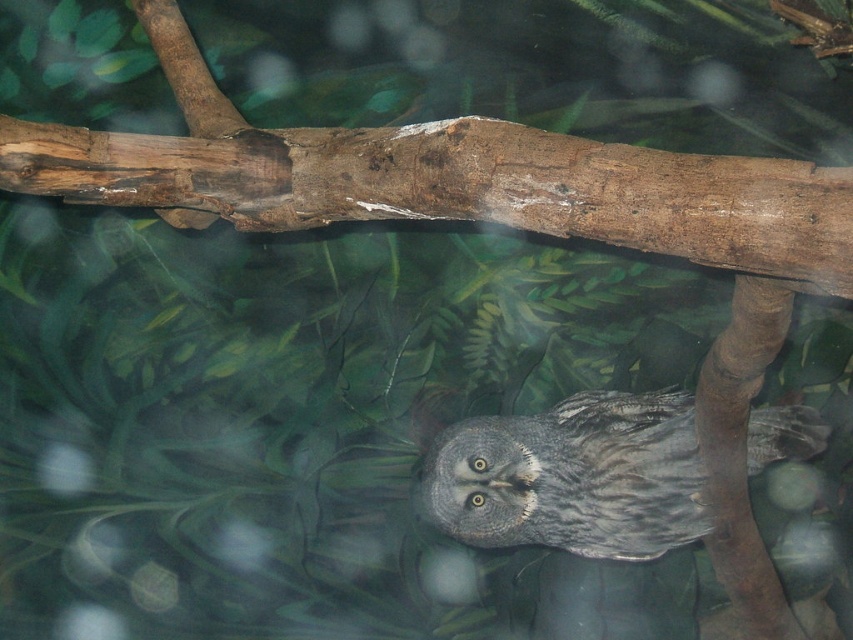
Question: Is brown rough wood at upper center smaller than gray fluffy owl at center?

Choices:
 (A) yes
 (B) no

Answer: (B)

Question: Among these points, which one is nearest to the camera?

Choices:
 (A) (669, 224)
 (B) (637, 467)

Answer: (A)

Question: Does brown rough wood at upper center come behind gray fluffy owl at center?

Choices:
 (A) yes
 (B) no

Answer: (B)

Question: Is brown rough wood at upper center wider than gray fluffy owl at center?

Choices:
 (A) yes
 (B) no

Answer: (A)

Question: Among these points, which one is nearest to the camera?

Choices:
 (A) (296, 147)
 (B) (534, 461)

Answer: (A)